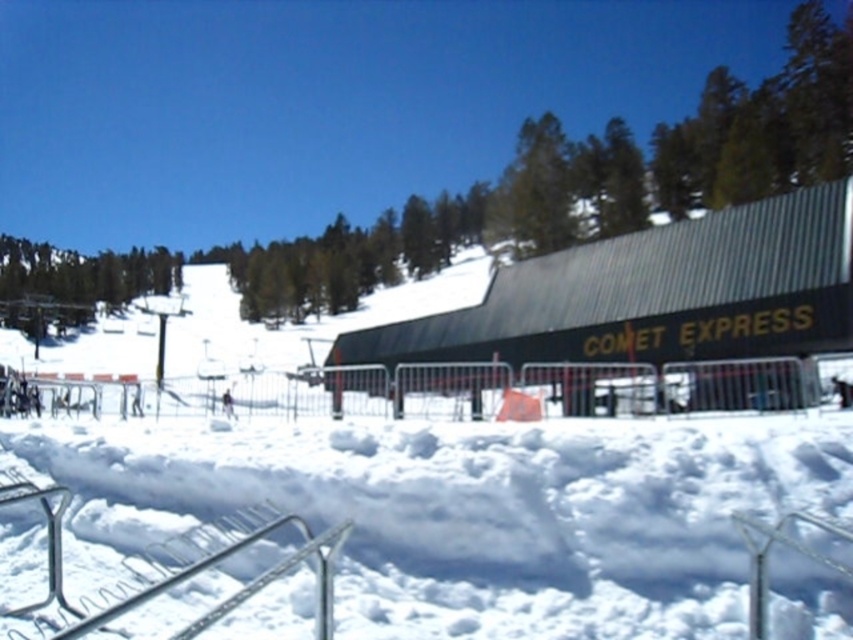
Is point (740, 301) less distant than point (258, 512)?

No, (740, 301) is behind (258, 512).

Which is behind, point (817, 273) or point (250, 518)?

The point (817, 273) is behind.

What are the coordinates of `metallic gray building at center-right` in the screenshot? It's located at (654, 294).

Measure the distance between white fluffy snow at lower center and metallic silver rail at lower center.

They are 2.73 meters apart.

Can you confirm if white fluffy snow at lower center is taller than metallic silver rail at lower center?

Yes.

What are the coordinates of `white fluffy snow at lower center` in the screenshot? It's located at (480, 509).

The image size is (853, 640). I want to click on white fluffy snow at lower center, so click(x=480, y=509).

Between white fluffy snow at lower center and metallic gray building at center-right, which one appears on the right side from the viewer's perspective?

metallic gray building at center-right

Who is higher up, white fluffy snow at lower center or metallic gray building at center-right?

metallic gray building at center-right is above.

This screenshot has height=640, width=853. Describe the element at coordinates (480, 509) in the screenshot. I see `white fluffy snow at lower center` at that location.

This screenshot has height=640, width=853. Find the location of `white fluffy snow at lower center`. white fluffy snow at lower center is located at coordinates (480, 509).